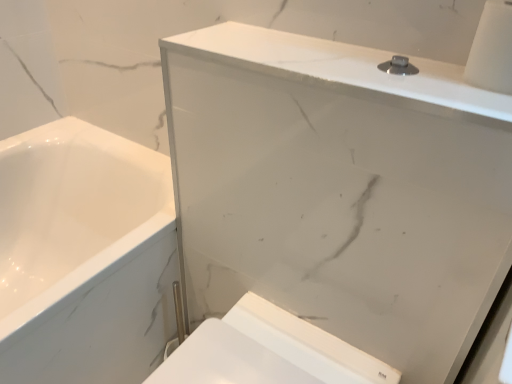
Where is `white marble medicine cabinet at upper center`? This screenshot has height=384, width=512. white marble medicine cabinet at upper center is located at coordinates (340, 190).

The image size is (512, 384). Describe the element at coordinates (340, 190) in the screenshot. I see `white marble medicine cabinet at upper center` at that location.

This screenshot has height=384, width=512. I want to click on white glossy toilet at lower right, so click(x=268, y=352).

This screenshot has height=384, width=512. What do you see at coordinates (268, 352) in the screenshot?
I see `white glossy toilet at lower right` at bounding box center [268, 352].

What are the coordinates of `white marble medicine cabinet at upper center` in the screenshot? It's located at (340, 190).

Which object is positioned more to the right, white marble medicine cabinet at upper center or white glossy toilet at lower right?

white marble medicine cabinet at upper center.

Considering the positions of objects white marble medicine cabinet at upper center and white glossy toilet at lower right in the image provided, who is behind, white marble medicine cabinet at upper center or white glossy toilet at lower right?

white glossy toilet at lower right is behind.

Considering the positions of points (212, 74) and (347, 366), is point (212, 74) farther from camera compared to point (347, 366)?

No, (212, 74) is closer to viewer.

From the image's perspective, would you say white marble medicine cabinet at upper center is shown under white glossy toilet at lower right?

No, from the image's perspective, white marble medicine cabinet at upper center is not below white glossy toilet at lower right.

From a real-world perspective, relative to white glossy toilet at lower right, is white marble medicine cabinet at upper center vertically above or below?

Clearly, from a real-world perspective, white marble medicine cabinet at upper center is above white glossy toilet at lower right.

Which object is thinner, white marble medicine cabinet at upper center or white glossy toilet at lower right?

white marble medicine cabinet at upper center is thinner.

Does white marble medicine cabinet at upper center have a greater height compared to white glossy toilet at lower right?

Indeed, white marble medicine cabinet at upper center has a greater height compared to white glossy toilet at lower right.

Can you confirm if white marble medicine cabinet at upper center is smaller than white glossy toilet at lower right?

Actually, white marble medicine cabinet at upper center might be larger than white glossy toilet at lower right.

Can we say white marble medicine cabinet at upper center lies outside white glossy toilet at lower right?

Yes.

Can you see white marble medicine cabinet at upper center touching white glossy toilet at lower right?

white marble medicine cabinet at upper center is not next to white glossy toilet at lower right, and they're not touching.

Is white marble medicine cabinet at upper center looking in the opposite direction of white glossy toilet at lower right?

Yes, white marble medicine cabinet at upper center is facing away from white glossy toilet at lower right.

How different are the orientations of white marble medicine cabinet at upper center and white glossy toilet at lower right in degrees?

The angular difference between white marble medicine cabinet at upper center and white glossy toilet at lower right is 0.00761 degrees.

Find the location of `toilet behind the white marble medicine cabinet at upper center`. toilet behind the white marble medicine cabinet at upper center is located at coordinates (268, 352).

Would you say white glossy toilet at lower right is to the left or to the right of white marble medicine cabinet at upper center in the picture?

From the image, it's evident that white glossy toilet at lower right is to the left of white marble medicine cabinet at upper center.

Looking at this image, is white glossy toilet at lower right closer to camera compared to white marble medicine cabinet at upper center?

That is False.

Is point (172, 381) positioned before point (476, 327)?

No.

From the picture: From the image's perspective, which is below, white glossy toilet at lower right or white marble medicine cabinet at upper center?

white glossy toilet at lower right is shown below in the image.

From a real-world perspective, which is physically below, white glossy toilet at lower right or white marble medicine cabinet at upper center?

In real-world perspective, white glossy toilet at lower right is lower.

Considering the relative sizes of white glossy toilet at lower right and white marble medicine cabinet at upper center in the image provided, is white glossy toilet at lower right thinner than white marble medicine cabinet at upper center?

No, white glossy toilet at lower right is not thinner than white marble medicine cabinet at upper center.

In the scene shown: Which of these two, white glossy toilet at lower right or white marble medicine cabinet at upper center, stands shorter?

Standing shorter between the two is white glossy toilet at lower right.

Can you confirm if white glossy toilet at lower right is smaller than white marble medicine cabinet at upper center?

Indeed, white glossy toilet at lower right has a smaller size compared to white marble medicine cabinet at upper center.

Could white marble medicine cabinet at upper center be considered to be inside white glossy toilet at lower right?

Definitely not — white marble medicine cabinet at upper center is not inside white glossy toilet at lower right.

Would you consider white glossy toilet at lower right to be distant from white marble medicine cabinet at upper center?

No.

Is white glossy toilet at lower right facing towards white marble medicine cabinet at upper center?

No, white glossy toilet at lower right is not facing towards white marble medicine cabinet at upper center.

How far apart are white glossy toilet at lower right and white marble medicine cabinet at upper center?

white glossy toilet at lower right is 9.13 inches away from white marble medicine cabinet at upper center.

The height and width of the screenshot is (384, 512). I want to click on medicine cabinet in front of the white glossy toilet at lower right, so click(340, 190).

Where is `medicine cabinet above the white glossy toilet at lower right (from the image's perspective)`? Image resolution: width=512 pixels, height=384 pixels. medicine cabinet above the white glossy toilet at lower right (from the image's perspective) is located at coordinates coord(340,190).

The image size is (512, 384). What are the coordinates of `toilet below the white marble medicine cabinet at upper center (from the image's perspective)` in the screenshot? It's located at (268, 352).